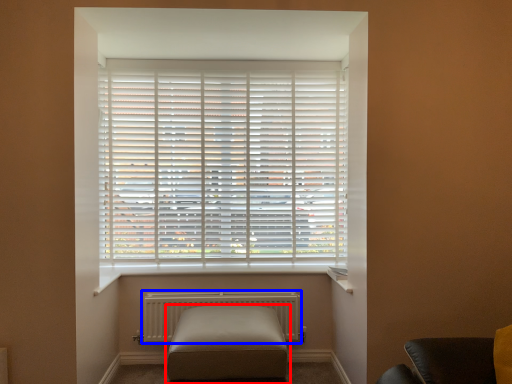
Question: Which of the following is the closest to the observer, furniture (highlighted by a red box) or radiator (highlighted by a blue box)?

Choices:
 (A) furniture
 (B) radiator

Answer: (A)